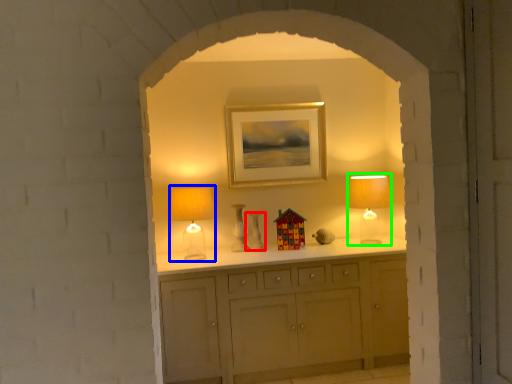
Question: Estimate the real-world distances between objects in this image. Which object is farther from vase (highlighted by a red box), table lamp (highlighted by a blue box) or table lamp (highlighted by a green box)?

Choices:
 (A) table lamp
 (B) table lamp

Answer: (B)